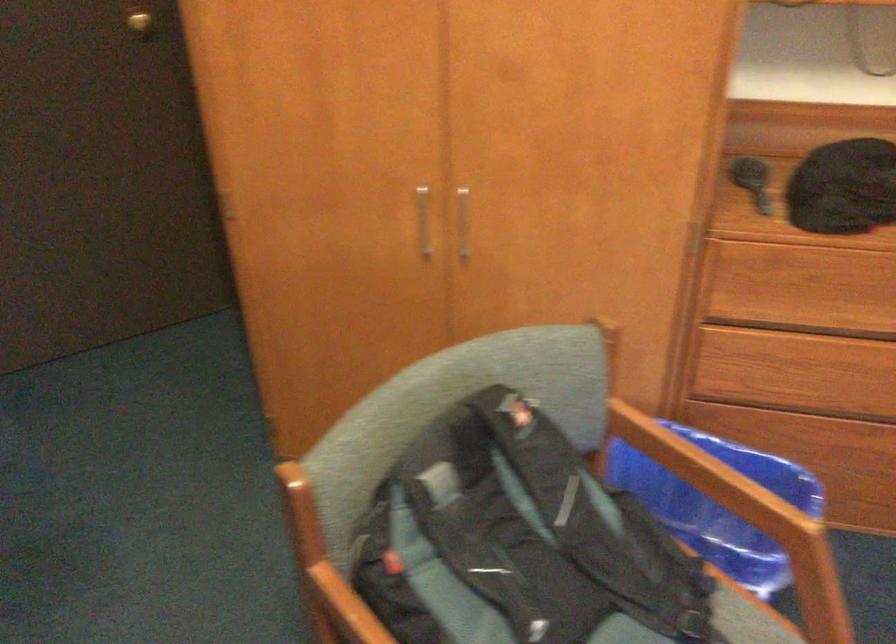
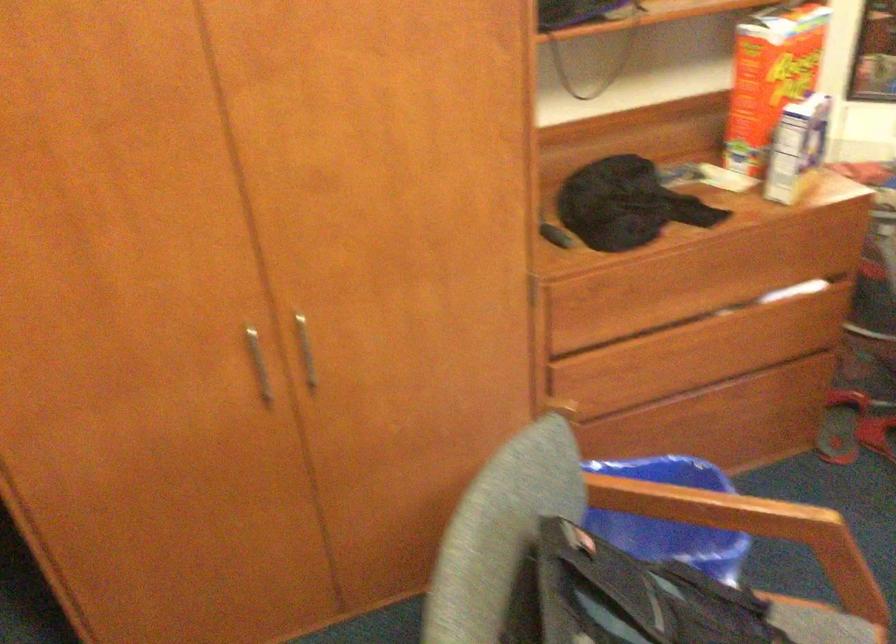
Question: The camera is either moving clockwise (left) or counter-clockwise (right) around the object. The first image is from the beginning of the video and the second image is from the end. Is the camera moving left or right when shooting the video?

Choices:
 (A) Left
 (B) Right

Answer: (A)